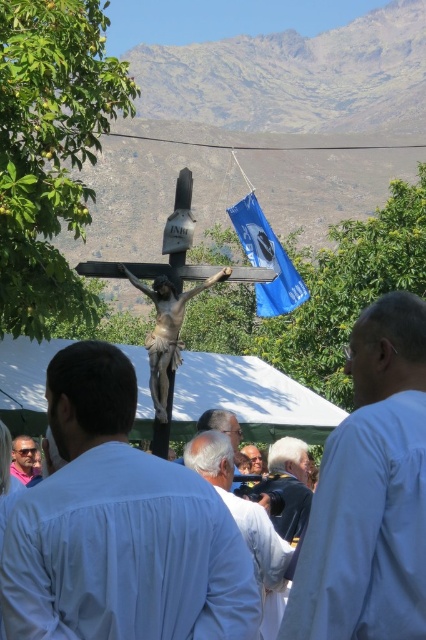
You are a photographer taking a portrait of the group under the white canopy tent. You notice the white matte shirt at right and the gray hair at center. Which of these two items should you focus on to ensure they are clearly visible in the photo, considering their sizes?

The white matte shirt at right has a larger size compared to the gray hair at center, so focusing on the white matte shirt at right would ensure it is clearly visible in the photo.

You are an event planner setting up decorations for an outdoor event. You have the white fabric canopy at center and the blue fabric flag at upper center. Based on the scene, which object is closer to the viewer?

The white fabric canopy at center is closer to the viewer because it is in front of the blue fabric flag at upper center.